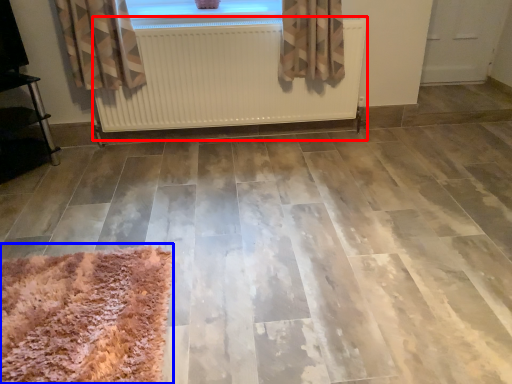
Question: Which of the following is the closest to the observer, radiator (highlighted by a red box) or mat (highlighted by a blue box)?

Choices:
 (A) radiator
 (B) mat

Answer: (B)